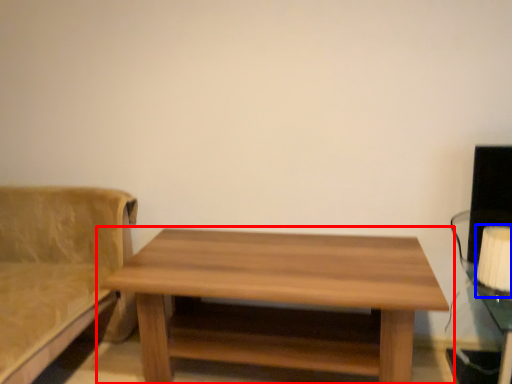
Question: Which object appears farthest to the camera in this image, table (highlighted by a red box) or table lamp (highlighted by a blue box)?

Choices:
 (A) table
 (B) table lamp

Answer: (B)